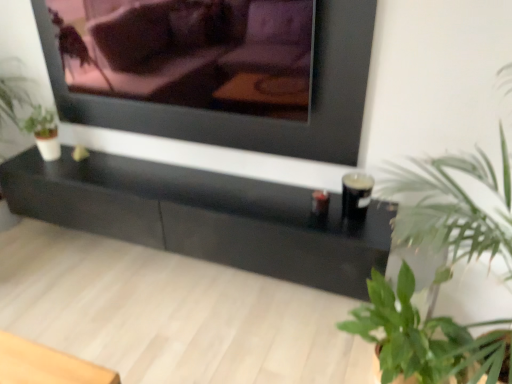
Find the location of a particular element. vacant region to the left of green leafy plant at lower right, positioned as the 1th houseplant in bottom-to-top order is located at coordinates (268, 348).